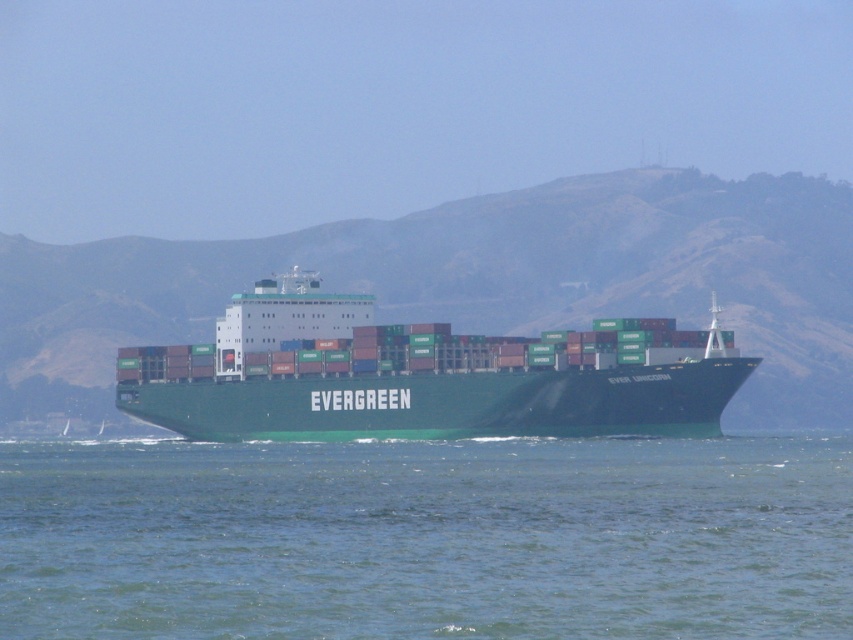
Question: Can you confirm if green water at center is wider than green matte container ship at center?

Choices:
 (A) no
 (B) yes

Answer: (B)

Question: Does green water at center have a smaller size compared to green matte container ship at center?

Choices:
 (A) yes
 (B) no

Answer: (A)

Question: Is green water at center wider than green matte container ship at center?

Choices:
 (A) no
 (B) yes

Answer: (B)

Question: Which of the following is the closest to the observer?

Choices:
 (A) (730, 444)
 (B) (241, 381)

Answer: (A)